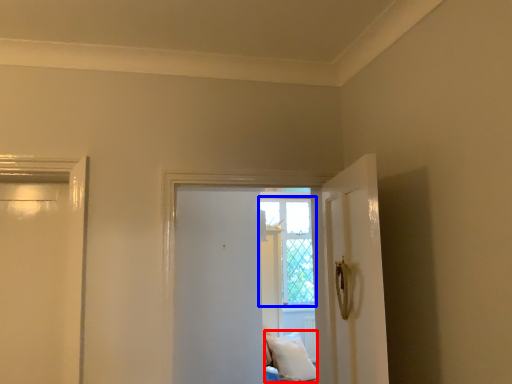
Question: Which point is closer to the camera, pillow (highlighted by a red box) or window (highlighted by a blue box)?

Choices:
 (A) pillow
 (B) window

Answer: (A)